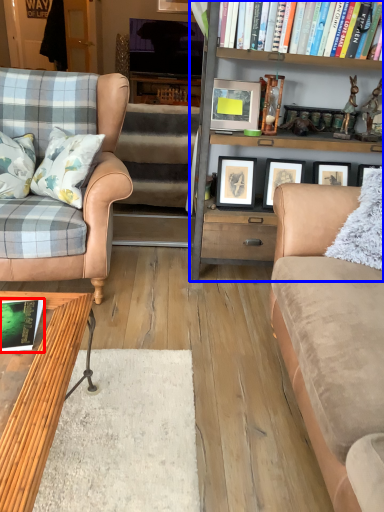
Question: Which of the following is the farthest to the observer, book (highlighted by a red box) or bookcase (highlighted by a blue box)?

Choices:
 (A) book
 (B) bookcase

Answer: (B)